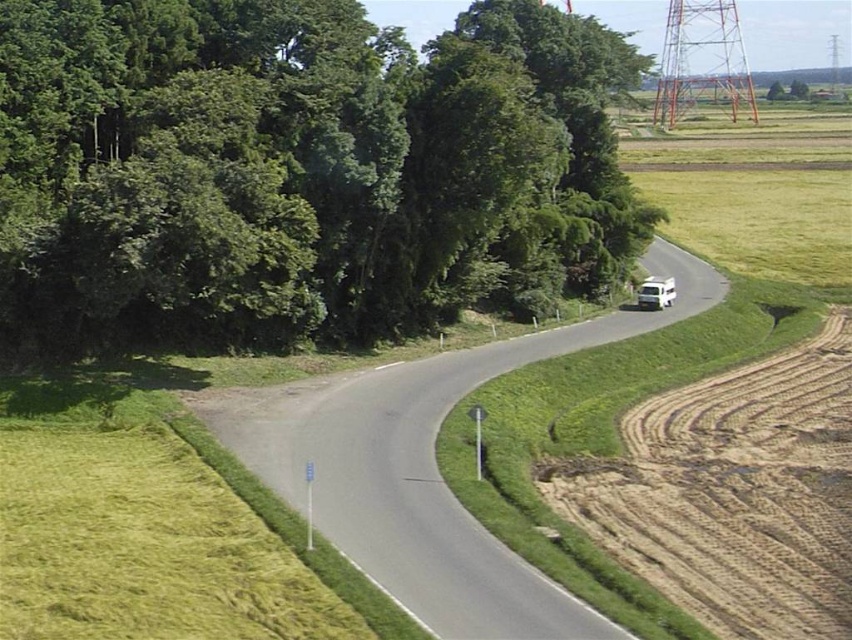
From the picture: You are standing at the center of the road in the rural landscape. Looking towards the green leafy trees at upper left, which direction should you face to see them clearly?

The green leafy trees at upper left are located at point coordinates, so you should face towards the upper left direction to see them clearly.

You are a hiker planning to take a photo of the brown textured dirt track at right from the green leafy trees at upper left. Can you see the entire dirt track from that vantage point?

The green leafy trees at upper left is much taller as brown textured dirt track at right. Since the trees are taller, they might block the view of the dirt track from that position, making it difficult to see the entire track.

You are a hiker planning to walk from the green leafy trees at upper left to the brown textured dirt track at right. Which path would require walking a longer distance if you choose to go along the edge of the road?

The path along the green leafy trees at upper left would require walking a longer distance because its width is larger than the brown textured dirt track at right.